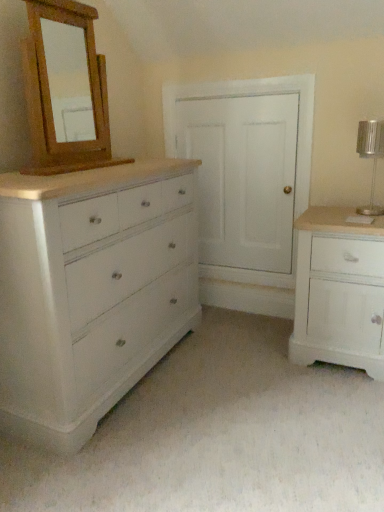
Question: Could white painted wood chest of drawers at left, the 1th chest of drawers viewed from the left, be considered to be inside white painted wood cabinet at right, arranged as the 2th chest of drawers when viewed from the left?

Choices:
 (A) yes
 (B) no

Answer: (B)

Question: Does white painted wood cabinet at right, which is counted as the 1th chest of drawers, starting from the right, have a greater height compared to white painted wood chest of drawers at left, the 1th chest of drawers viewed from the left?

Choices:
 (A) yes
 (B) no

Answer: (B)

Question: Is white painted wood cabinet at right, which is counted as the 1th chest of drawers, starting from the right, closer to the viewer compared to white painted wood chest of drawers at left, marked as the second chest of drawers in a right-to-left arrangement?

Choices:
 (A) no
 (B) yes

Answer: (A)

Question: From a real-world perspective, is white painted wood cabinet at right, arranged as the 2th chest of drawers when viewed from the left, over white painted wood chest of drawers at left, the 1th chest of drawers viewed from the left?

Choices:
 (A) no
 (B) yes

Answer: (A)

Question: Is the position of white painted wood cabinet at right, which is counted as the 1th chest of drawers, starting from the right, more distant than that of white painted wood chest of drawers at left, marked as the second chest of drawers in a right-to-left arrangement?

Choices:
 (A) yes
 (B) no

Answer: (A)

Question: From a real-world perspective, is white painted wood cabinet at right, arranged as the 2th chest of drawers when viewed from the left, beneath white painted wood chest of drawers at left, marked as the second chest of drawers in a right-to-left arrangement?

Choices:
 (A) yes
 (B) no

Answer: (A)

Question: From the image's perspective, is wooden mirror at upper left over silver metallic table lamp at right?

Choices:
 (A) no
 (B) yes

Answer: (B)

Question: Considering the relative sizes of wooden mirror at upper left and silver metallic table lamp at right in the image provided, is wooden mirror at upper left smaller than silver metallic table lamp at right?

Choices:
 (A) no
 (B) yes

Answer: (A)

Question: Does wooden mirror at upper left turn towards silver metallic table lamp at right?

Choices:
 (A) no
 (B) yes

Answer: (B)

Question: Is wooden mirror at upper left far away from silver metallic table lamp at right?

Choices:
 (A) no
 (B) yes

Answer: (B)

Question: Is wooden mirror at upper left taller than silver metallic table lamp at right?

Choices:
 (A) no
 (B) yes

Answer: (B)

Question: Considering the relative sizes of wooden mirror at upper left and silver metallic table lamp at right in the image provided, is wooden mirror at upper left thinner than silver metallic table lamp at right?

Choices:
 (A) yes
 (B) no

Answer: (A)

Question: Does silver metallic table lamp at right have a lesser width compared to wooden mirror at upper left?

Choices:
 (A) yes
 (B) no

Answer: (B)